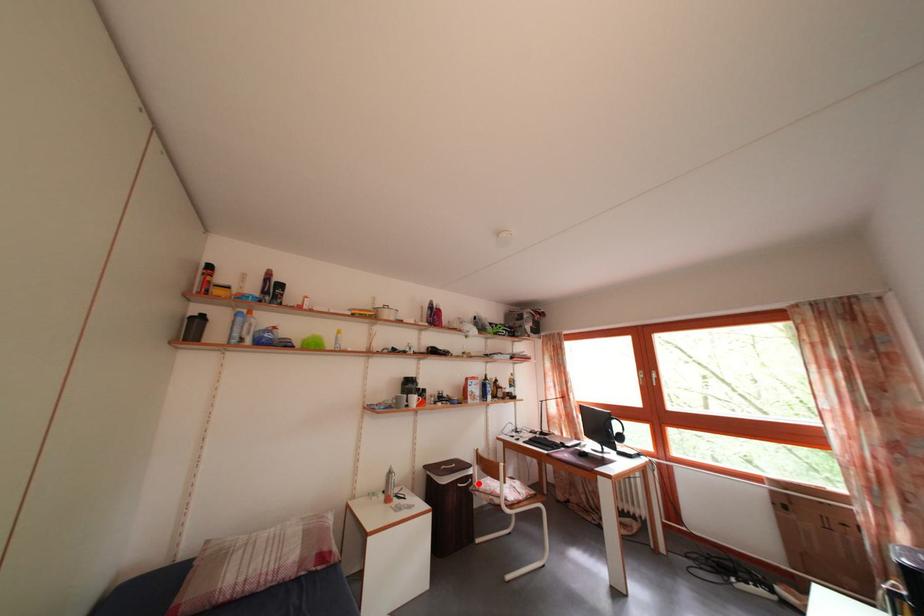
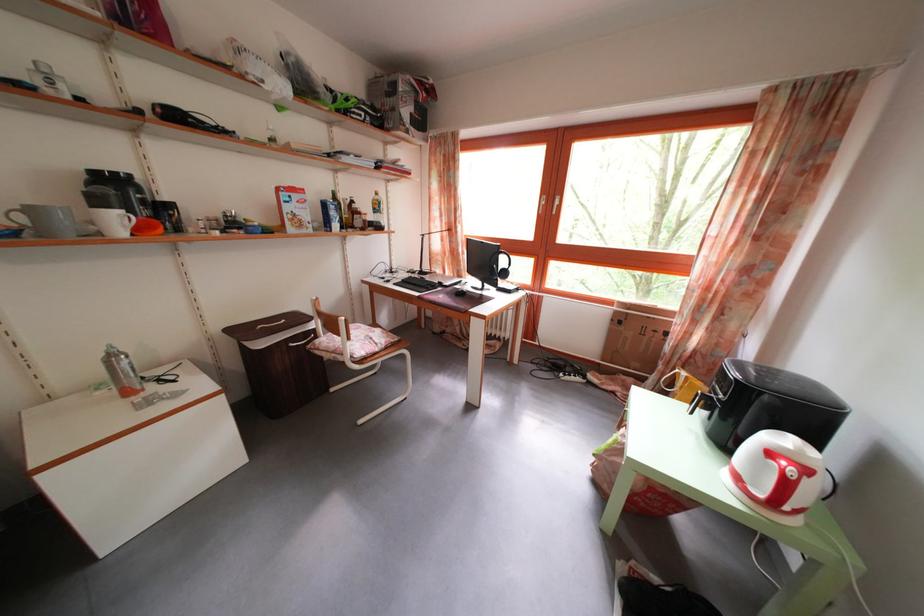
Question: I am providing you with two images of the same scene from different viewpoints. A red point is marked on the first image. Can you still see the location of the red point in image 2?

Choices:
 (A) Yes
 (B) No

Answer: (A)